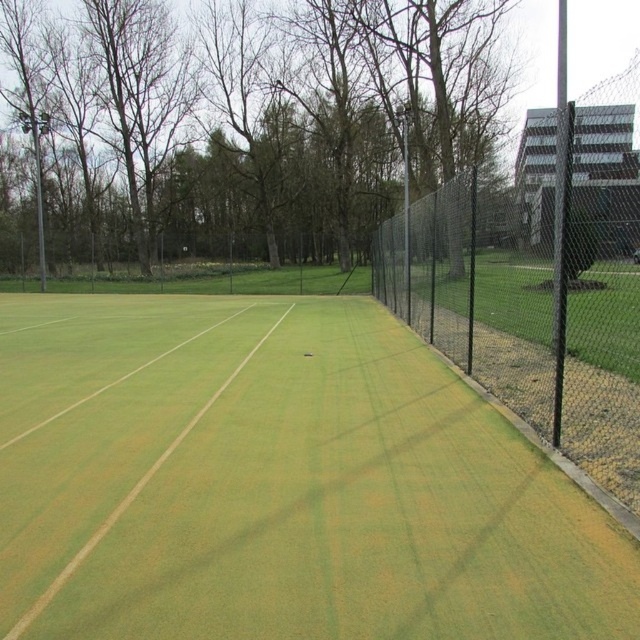
You are standing on the tennis court and want to throw a tennis ball to a friend who is exactly 4 meters away from you. Is the point at coordinates point (481, 518) within the throwing distance?

The distance between point (481, 518) and the viewer is 4.15 meters, so the point is slightly out of the 4 meter throwing range.